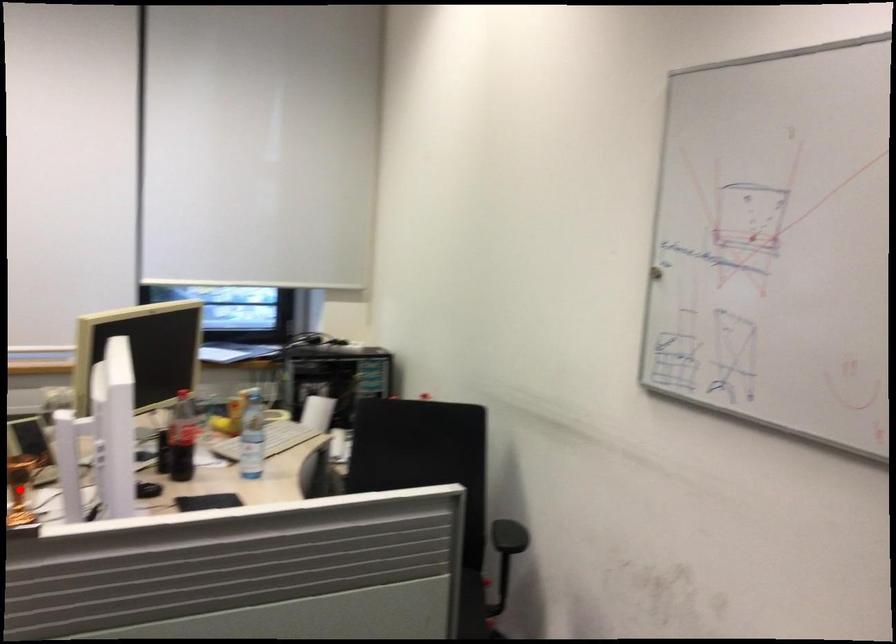
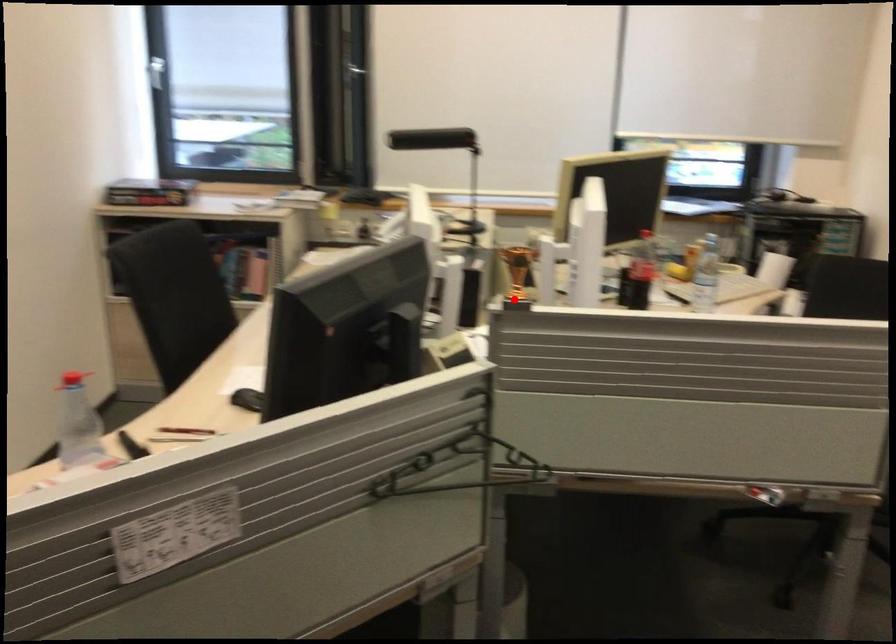
I am providing you with two images of the same scene from different viewpoints. A red point is marked on the first image and another point is marked on the second image. Is the marked point in image1 the same physical position as the marked point in image2?

Yes